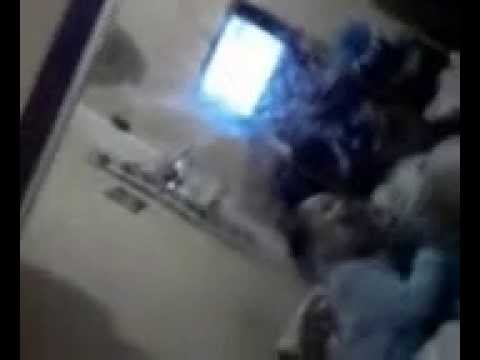
Where is `wall`? wall is located at coordinates (115, 280), (60, 209), (153, 45).